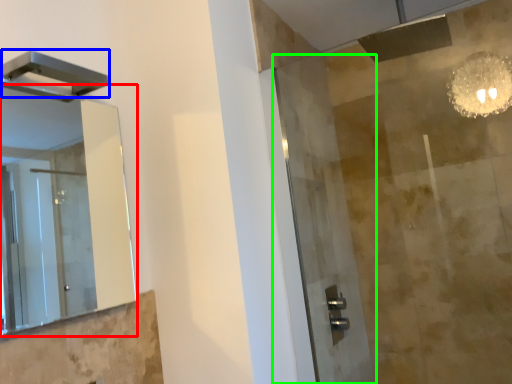
Question: Which object is positioned closest to mirror (highlighted by a red box)? Select from shower (highlighted by a blue box) and screen door (highlighted by a green box).

Choices:
 (A) shower
 (B) screen door

Answer: (B)